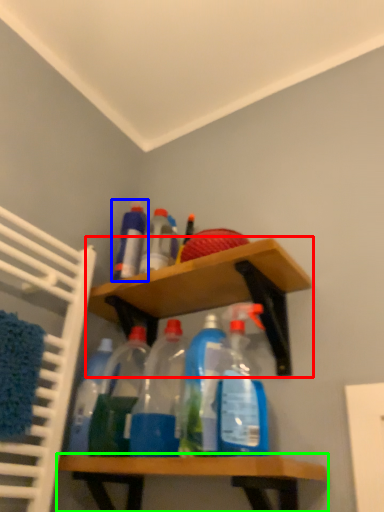
Question: Considering the real-world distances, which object is farthest from shelf (highlighted by a red box)? bottle (highlighted by a blue box) or shelf (highlighted by a green box)?

Choices:
 (A) bottle
 (B) shelf

Answer: (B)